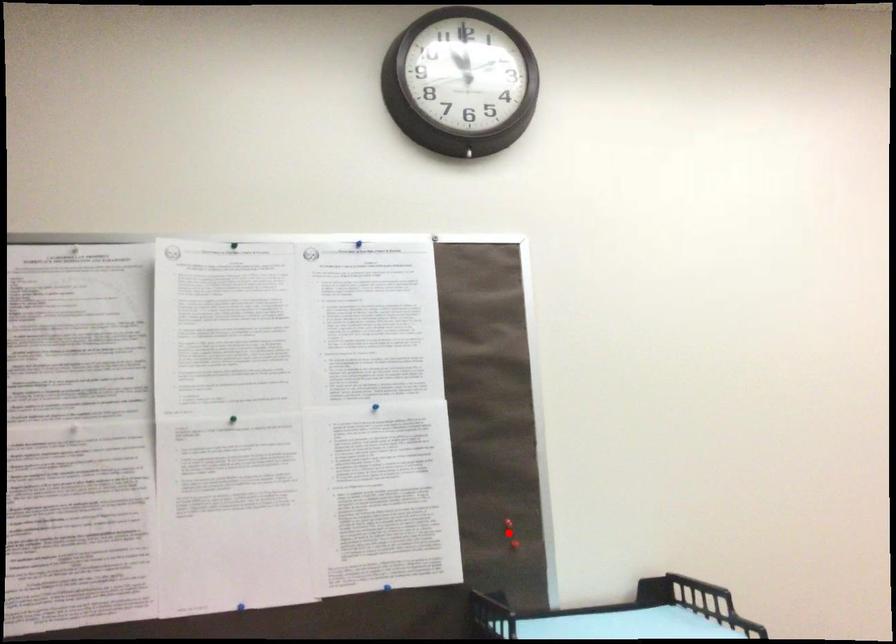
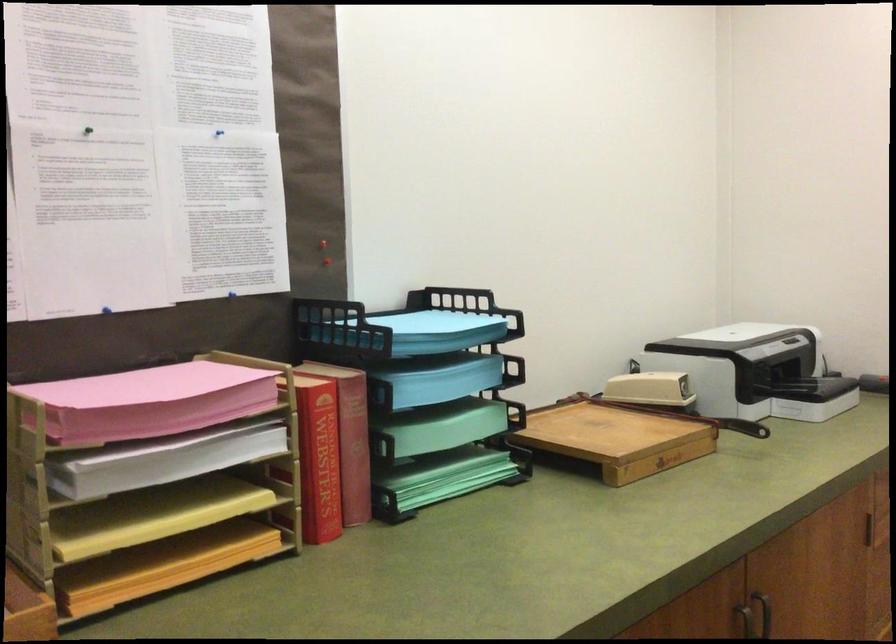
Question: I am providing you with two images of the same scene from different viewpoints. Image1 has a red point marked. In image2, the corresponding 3D location appears at what relative position? Reply with the corresponding letter.

Choices:
 (A) Closer
 (B) Farther

Answer: (B)